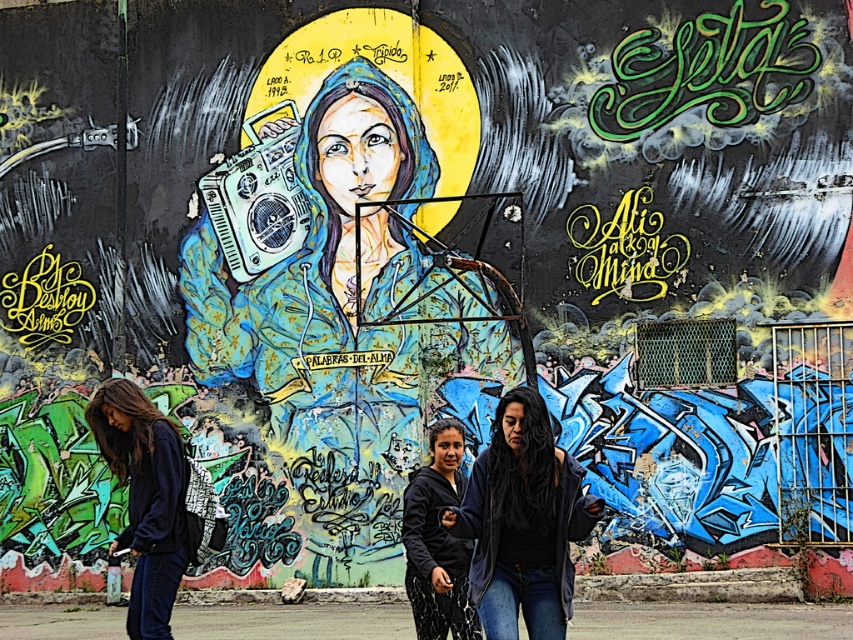
Question: Observing the image, what is the correct spatial positioning of dark blue jacket at lower left in reference to metallic blue boombox at center?

Choices:
 (A) left
 (B) right

Answer: (B)

Question: Among these points, which one is nearest to the camera?

Choices:
 (A) (270, 172)
 (B) (518, 426)
 (C) (126, 440)

Answer: (B)

Question: Is dark blue denim jeans at center closer to the viewer compared to metallic blue boombox at center?

Choices:
 (A) yes
 (B) no

Answer: (A)

Question: In this image, where is dark blue jacket at lower left located relative to metallic blue boombox at center?

Choices:
 (A) left
 (B) right

Answer: (B)

Question: Which object appears farthest from the camera in this image?

Choices:
 (A) dark blue denim jeans at center
 (B) metallic blue boombox at center

Answer: (B)

Question: Which of the following is the farthest from the observer?

Choices:
 (A) dark blue denim jeans at center
 (B) dark blue jacket at lower left

Answer: (B)